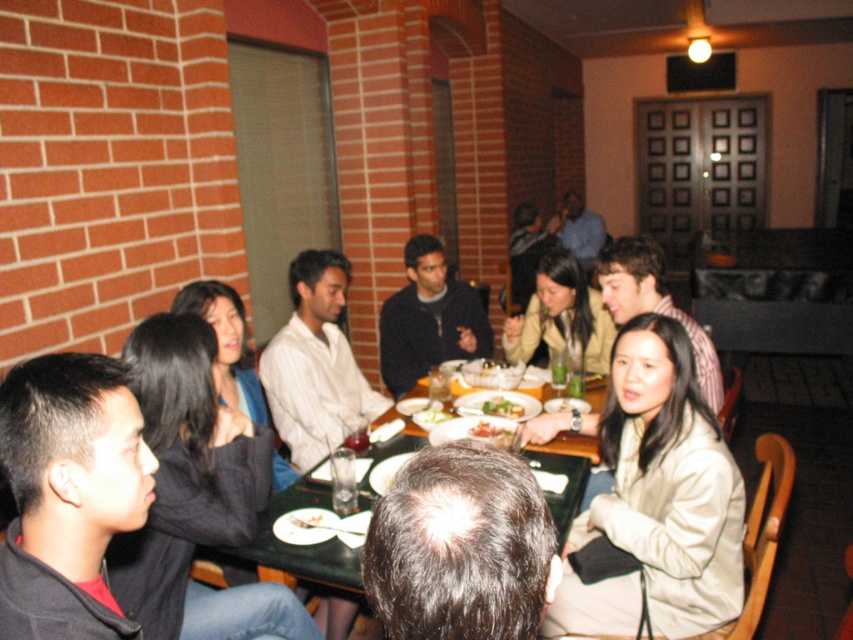
Does dark blue sweater at center appear on the right side of white glossy plate at center?

Incorrect, dark blue sweater at center is not on the right side of white glossy plate at center.

Does dark blue sweater at center have a greater width compared to white glossy plate at center?

Yes, dark blue sweater at center is wider than white glossy plate at center.

Which is in front, point (410, 291) or point (480, 420)?

Point (480, 420) is more forward.

Find the location of a particular element. This screenshot has width=853, height=640. dark blue sweater at center is located at coordinates (428, 320).

Is green glossy table at center positioned at the back of green leafy salad at center?

No, green glossy table at center is closer to the viewer.

Where is `green glossy table at center`? Image resolution: width=853 pixels, height=640 pixels. green glossy table at center is located at coordinates (297, 548).

Which is behind, point (503, 413) or point (509, 429)?

The point (503, 413) is more distant.

Is point (503, 413) behind point (486, 422)?

Yes, point (503, 413) is farther from viewer.

I want to click on green leafy salad at center, so click(x=502, y=406).